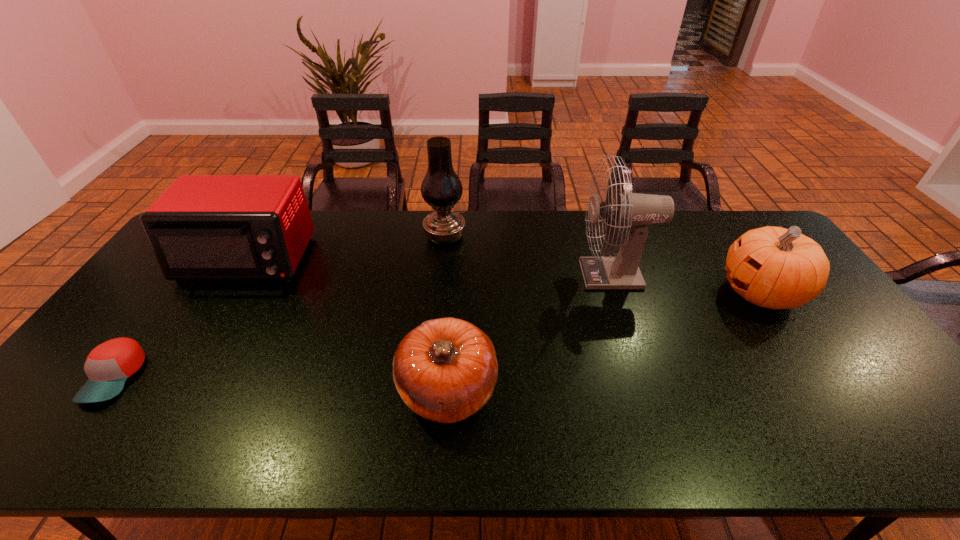
Image resolution: width=960 pixels, height=540 pixels. Identify the location of object at the near edge. (445, 370).

You are a GUI agent. You are given a task and a screenshot of the screen. Output one action in this format:
    pyautogui.click(x=<x>, y=<y>)
    Task: Click on the toaster oven situated at the left edge
    
    Given the screenshot: What is the action you would take?
    pyautogui.click(x=203, y=227)

Where is `baseball cap present at the left edge`? baseball cap present at the left edge is located at coordinates (108, 366).

Where is `object at the right edge`? object at the right edge is located at coordinates (773, 267).

Image resolution: width=960 pixels, height=540 pixels. I want to click on object that is at the far left corner, so click(203, 227).

Locate an element on the screen. Image resolution: width=960 pixels, height=540 pixels. vacant area at the far edge is located at coordinates (709, 241).

Locate an element on the screen. vacant position at the near edge of the desktop is located at coordinates (656, 434).

In the image, there is a desktop. Where is `free space at the right edge`? The height and width of the screenshot is (540, 960). free space at the right edge is located at coordinates (837, 361).

Locate an element on the screen. Image resolution: width=960 pixels, height=540 pixels. free space between the toaster oven and the farther pumpkin is located at coordinates (504, 276).

Identify the location of vacant space in between the fan and the baseball cap. (364, 326).